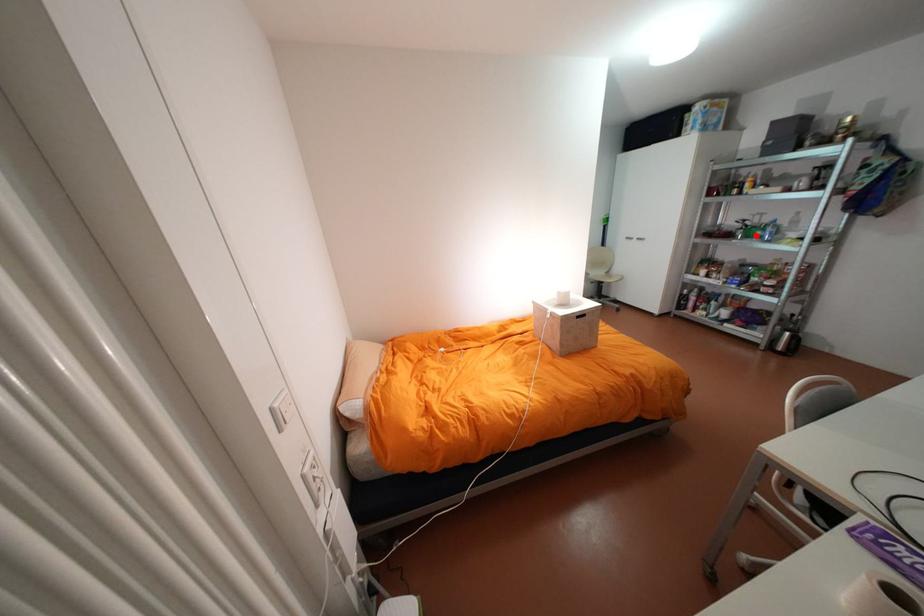
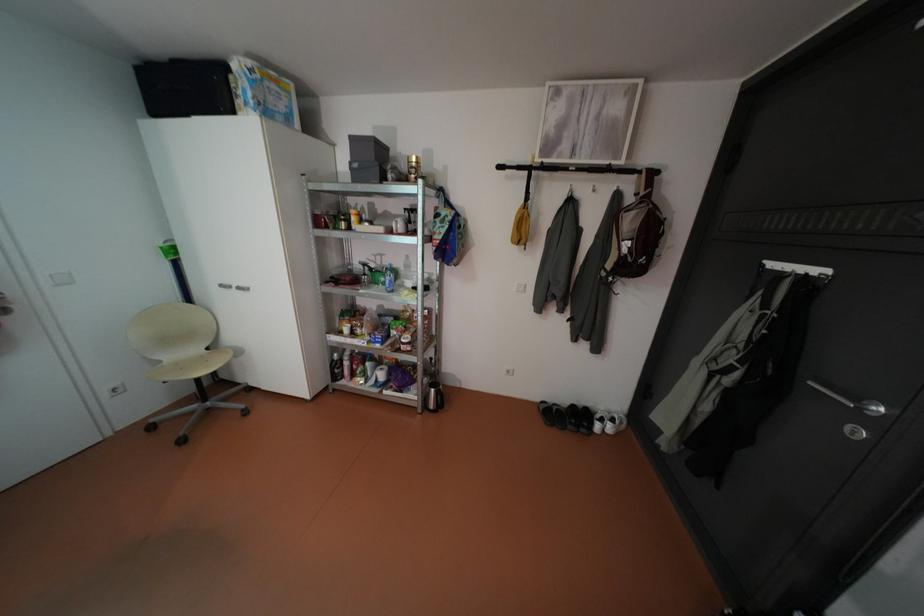
The point at the highlighted location is marked in the first image. Where is the corresponding point in the second image?

(383, 282)